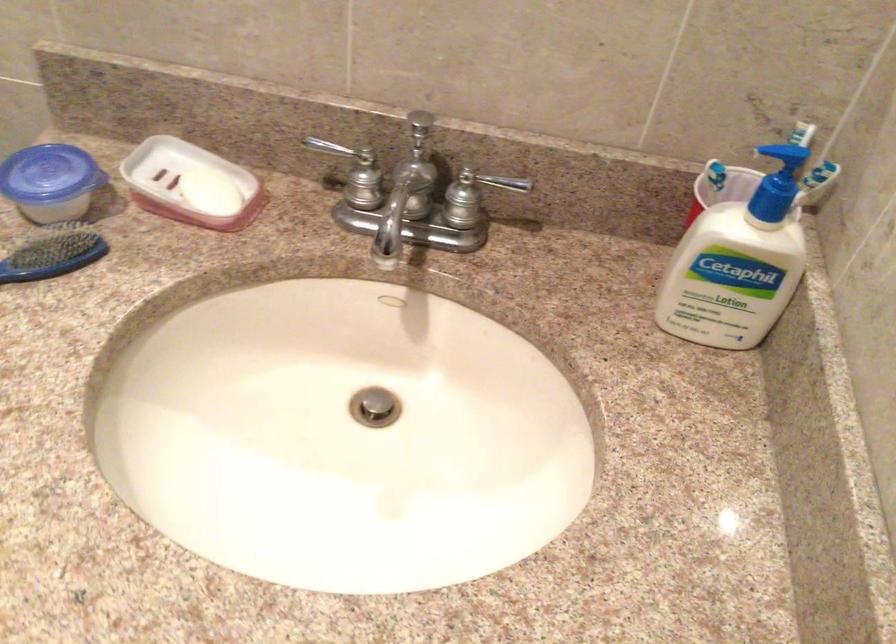
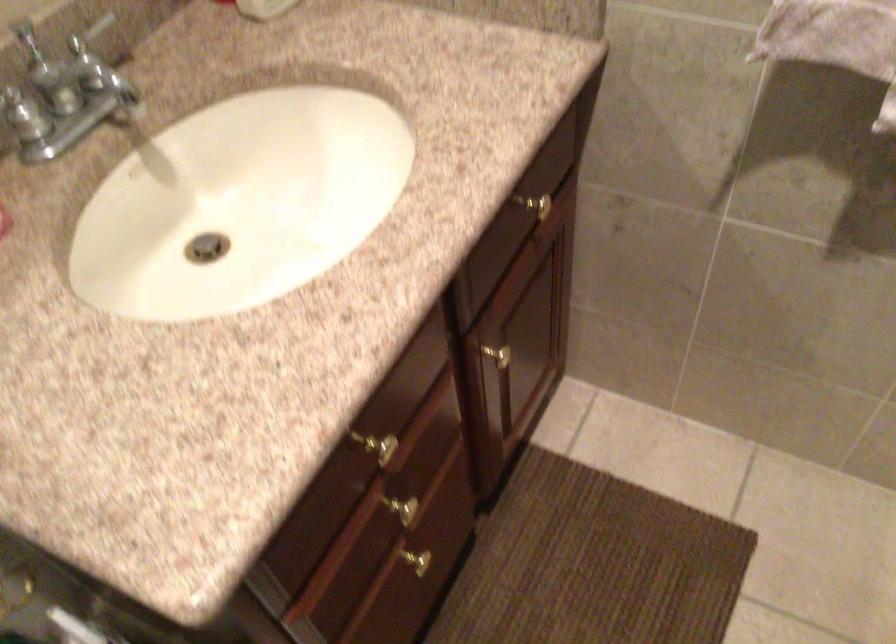
First-person continuous shooting, in which direction is the camera rotating?

The camera rotated toward right-down.